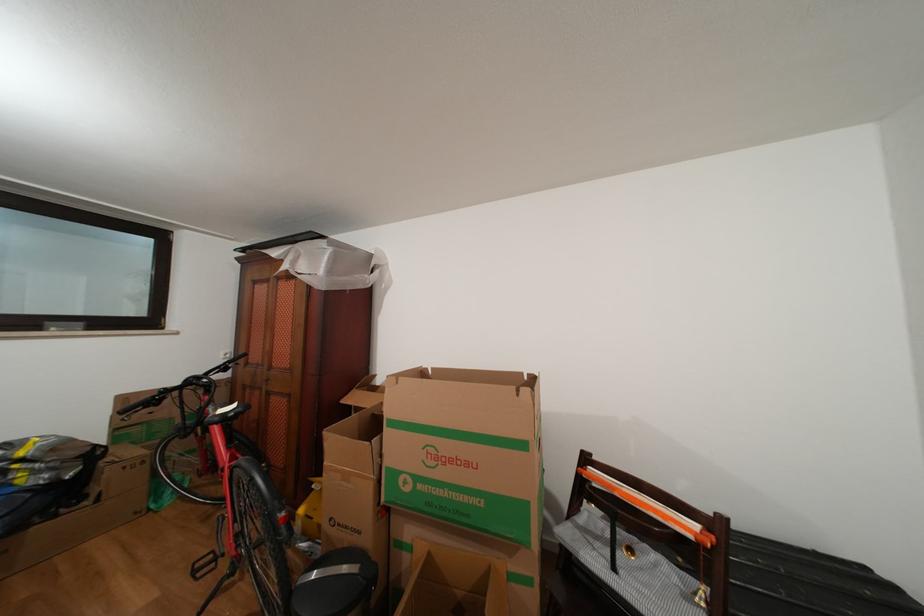
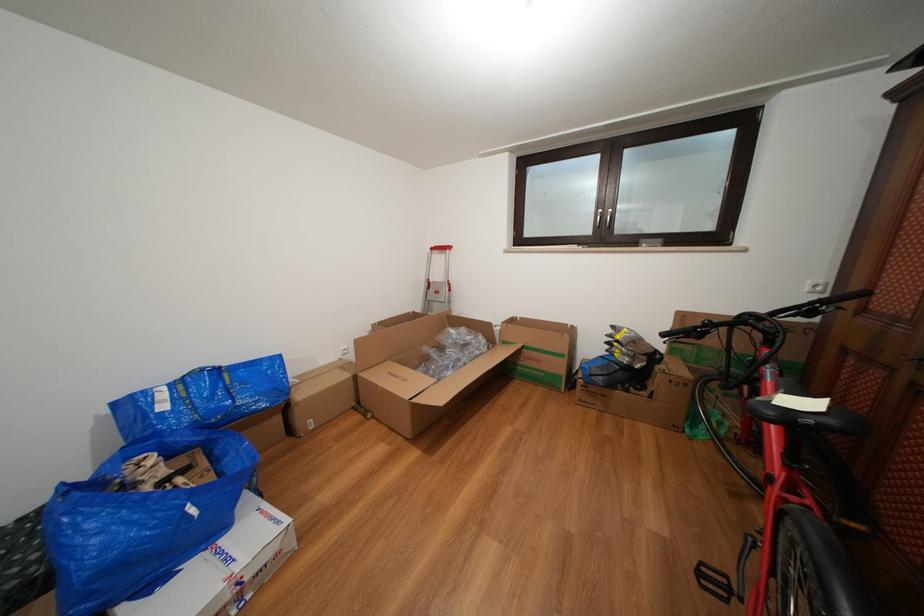
Where in the second image is the point corresponding to the point at 253,360 from the first image?

(873, 300)